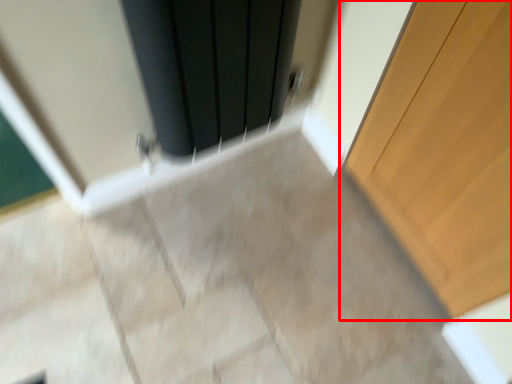
Question: From the image's perspective, what is the correct spatial relationship of door (annotated by the red box) in relation to screen door?

Choices:
 (A) above
 (B) below

Answer: (B)